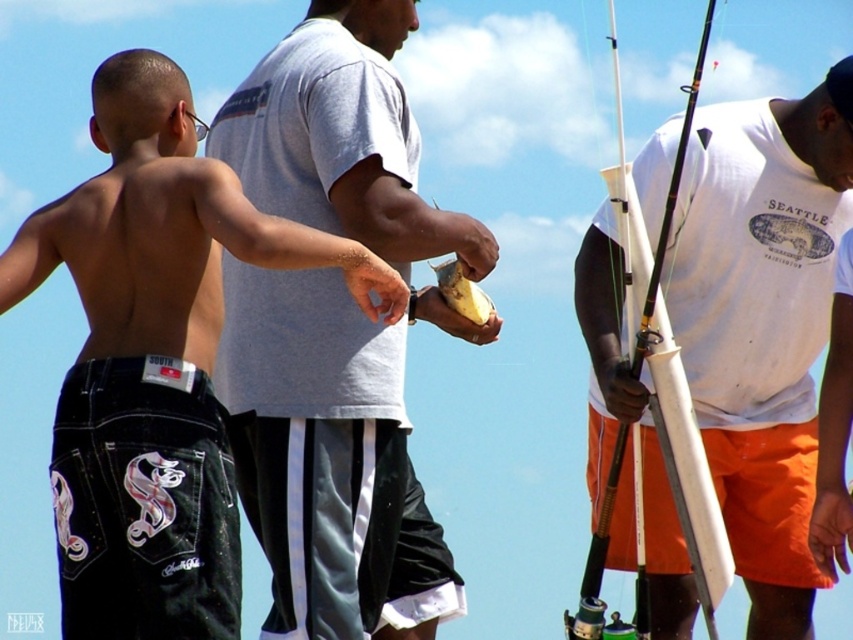
Question: Which of the following is the closest to the observer?

Choices:
 (A) white matte fishing rod at center
 (B) matte gray t-shirt at center
 (C) black denim shorts at left

Answer: (C)

Question: Does black denim shorts at left come in front of black denim shorts at lower left?

Choices:
 (A) no
 (B) yes

Answer: (B)

Question: Can you confirm if matte gray t-shirt at center is positioned to the left of white matte fishing rod at center?

Choices:
 (A) no
 (B) yes

Answer: (B)

Question: Is matte gray t-shirt at center smaller than black denim shorts at lower left?

Choices:
 (A) yes
 (B) no

Answer: (A)

Question: Among these objects, which one is farthest from the camera?

Choices:
 (A) matte gray t-shirt at center
 (B) white matte fishing rod at center
 (C) black denim shorts at lower left

Answer: (A)

Question: Which of the following is the farthest from the observer?

Choices:
 (A) (222, 140)
 (B) (718, 477)

Answer: (A)